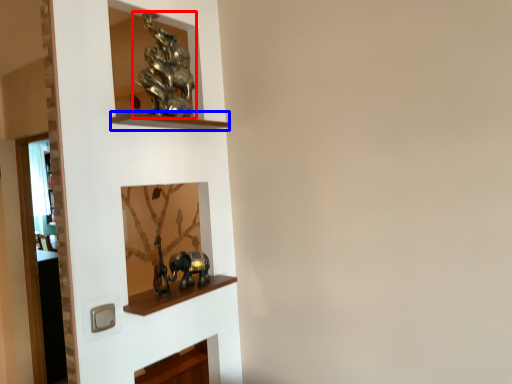
Question: Which object is further to the camera taking this photo, art (highlighted by a red box) or cabinet (highlighted by a blue box)?

Choices:
 (A) art
 (B) cabinet

Answer: (A)